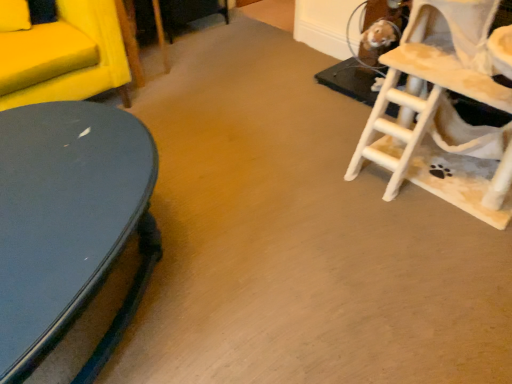
This screenshot has height=384, width=512. Identify the location of vacant point to the right of glossy dark blue table at left. (280, 258).